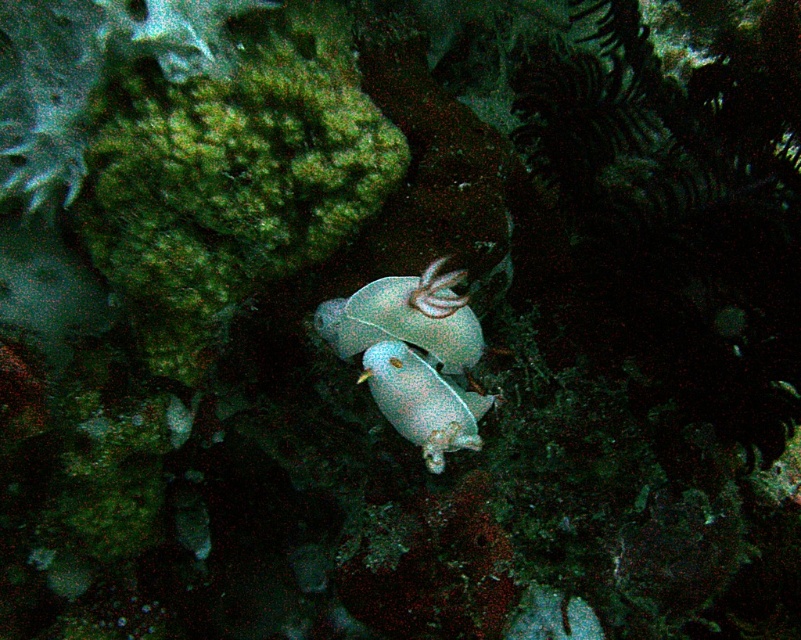
Is translucent blue shell at center wider than translucent white fish at center?

Yes.

Is translucent blue shell at center above translucent white fish at center?

Correct, translucent blue shell at center is located above translucent white fish at center.

Locate an element on the screen. The width and height of the screenshot is (801, 640). translucent blue shell at center is located at coordinates (405, 317).